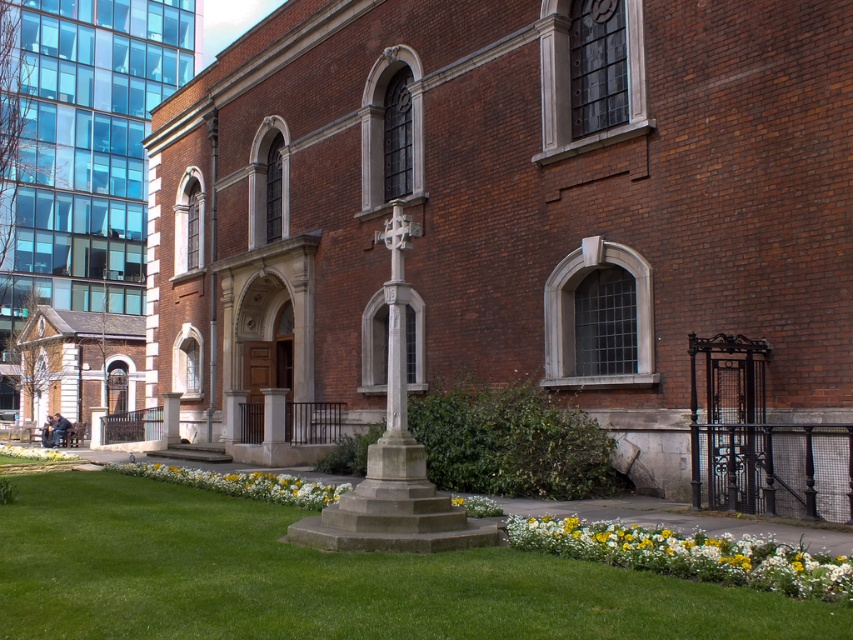
Does green grass at center lie behind yellow fabric flower at lower left?

No, green grass at center is closer to the viewer.

Who is lower down, green grass at center or yellow fabric flower at lower left?

Answer: Positioned lower is yellow fabric flower at lower left.

Is point (265, 611) farther from camera compared to point (42, 460)?

No.

You are a GUI agent. You are given a task and a screenshot of the screen. Output one action in this format:
    pyautogui.click(x=<x>, y=<y>)
    Task: Click on the green grass at center
    This screenshot has height=640, width=853.
    Given the screenshot: What is the action you would take?
    pyautogui.click(x=323, y=579)

Does green grass at center appear under yellow matte flowers at lower center?

Correct, green grass at center is located below yellow matte flowers at lower center.

In the scene shown: Is green grass at center wider than yellow matte flowers at lower center?

Indeed, green grass at center has a greater width compared to yellow matte flowers at lower center.

This screenshot has height=640, width=853. Find the location of `green grass at center`. green grass at center is located at coordinates (323, 579).

Who is more distant from viewer, [815,588] or [79,460]?

Positioned behind is point [79,460].

Between yellow matte flowers at lower center and yellow fabric flower at lower left, which one appears on the left side from the viewer's perspective?

yellow fabric flower at lower left is more to the left.

Between point (582, 556) and point (50, 454), which one is positioned behind?

The point (50, 454) is more distant.

The height and width of the screenshot is (640, 853). Identify the location of yellow matte flowers at lower center. (689, 556).